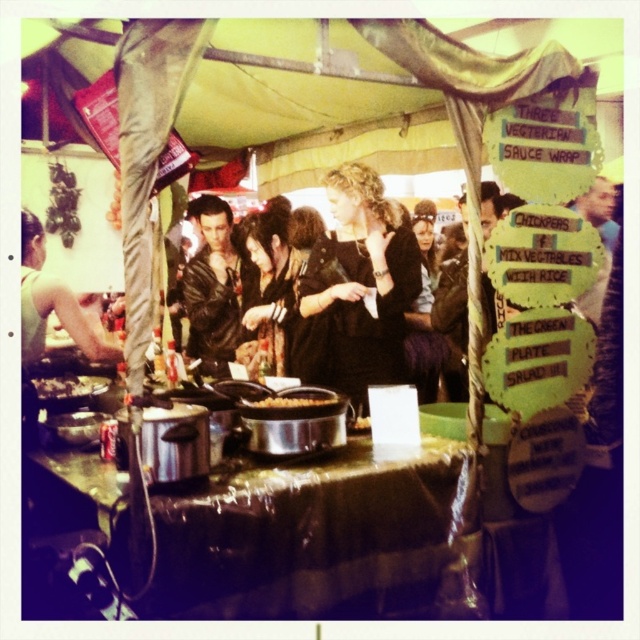
Does black matte dress at center appear on the right side of shiny black hair at center?

Indeed, black matte dress at center is positioned on the right side of shiny black hair at center.

Measure the distance between black matte dress at center and camera.

They are 9.66 feet apart.

Where is `black matte dress at center`? black matte dress at center is located at coordinates (356, 289).

Looking at this image, which of these two, black matte dress at center or slightly browned metal pan at center, stands shorter?

slightly browned metal pan at center is shorter.

Can you confirm if black matte dress at center is positioned to the right of slightly browned metal pan at center?

Incorrect, black matte dress at center is not on the right side of slightly browned metal pan at center.

Which is in front, point (307, 340) or point (352, 429)?

Point (352, 429) is in front.

At what (x,y) coordinates should I click in order to perform the action: click on black matte dress at center. Please return your answer as a coordinate pair (x, y). Looking at the image, I should click on (356, 289).

Is point (346, 268) farther from viewer compared to point (186, 312)?

No.

Can you confirm if black matte dress at center is positioned below leather jacket at center?

Actually, black matte dress at center is above leather jacket at center.

Who is more distant from viewer, (x=381, y=326) or (x=188, y=352)?

The point (x=188, y=352) is behind.

This screenshot has width=640, height=640. I want to click on black matte dress at center, so click(356, 289).